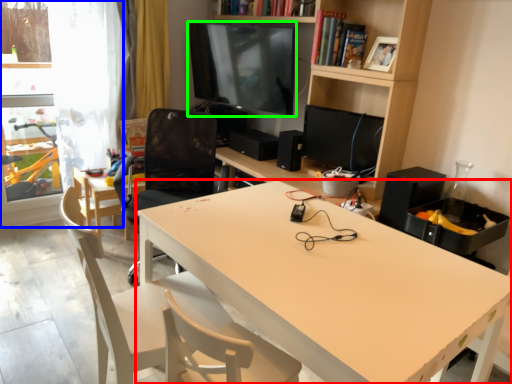
Question: Which object is positioned closest to desk (highlighted by a red box)? Select from glass door (highlighted by a blue box) and television (highlighted by a green box).

Choices:
 (A) glass door
 (B) television

Answer: (B)